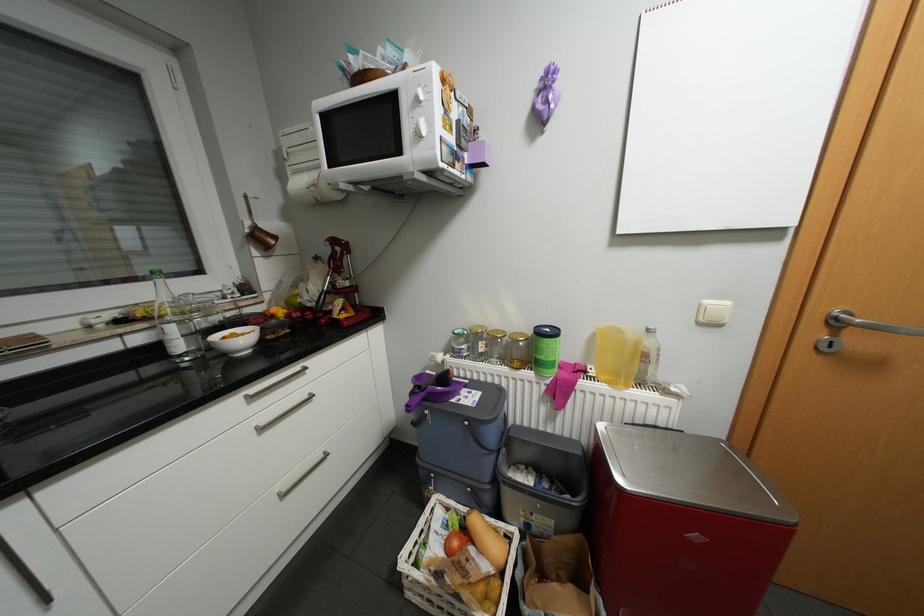
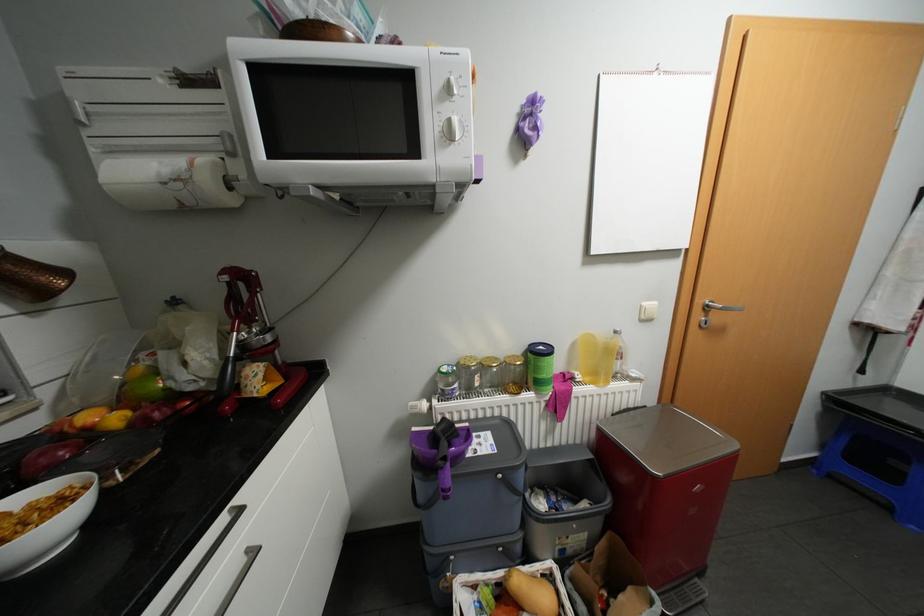
In the second image, find the point that corresponds to [708,323] in the first image.

(649, 320)